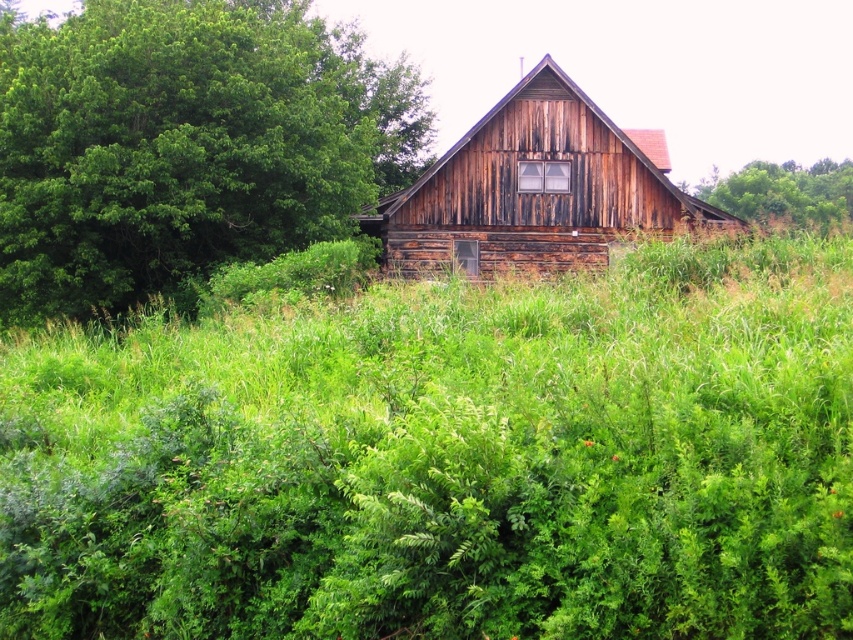
You are standing in front of the rustic wooden barn at center and want to take a photo of the green leafy tree at upper left. Considering their sizes, which object would appear bigger in the photo?

The green leafy tree at upper left would appear bigger in the photo because it has a larger size compared to the rustic wooden barn at center.

You are standing in front of the rustic wooden house and notice two green leafy elements. Which one is positioned to the left of the other? The options are the green leafy grass at center and the green leafy tree at upper right.

The green leafy grass at center is positioned to the left of the green leafy tree at upper right.

You are standing in front of the rustic wooden house and want to step onto the path that leads to the front door. However, there is green leafy grass at center blocking your way. Can you move the grass to access the path?

The green leafy grass at center is located at point (450,461), which means it is positioned centrally in the scene. Since the grass is blocking the path, you would need to clear it to access the front door.